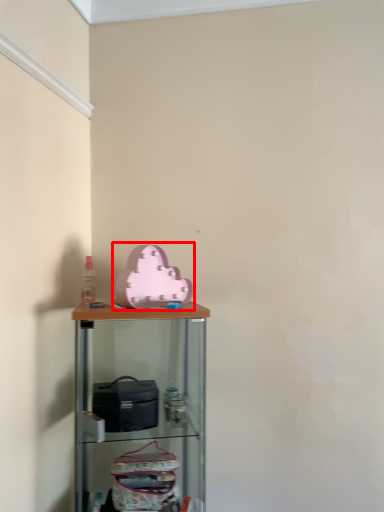
Question: Observing the image, what is the correct spatial positioning of toy (annotated by the red box) in reference to shelf?

Choices:
 (A) right
 (B) left

Answer: (A)